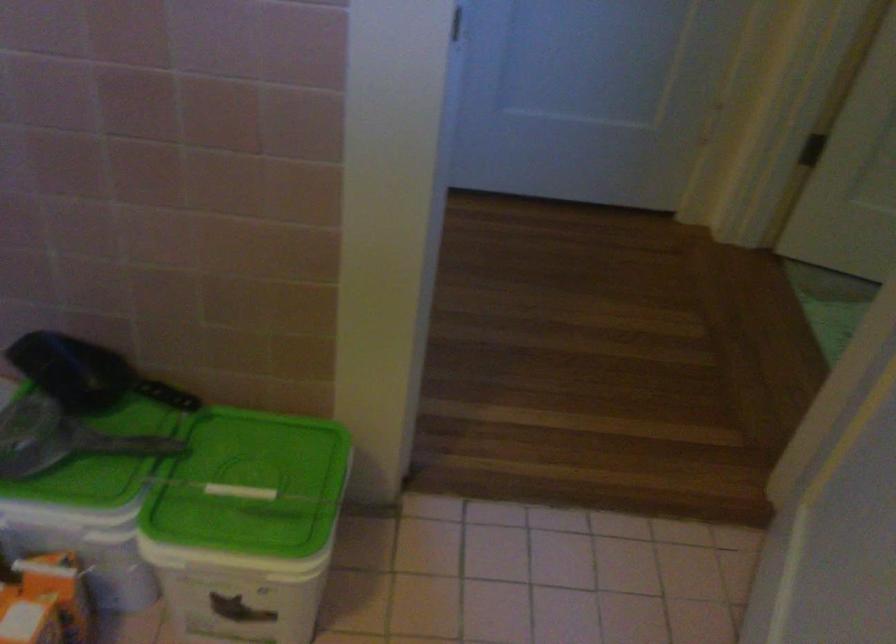
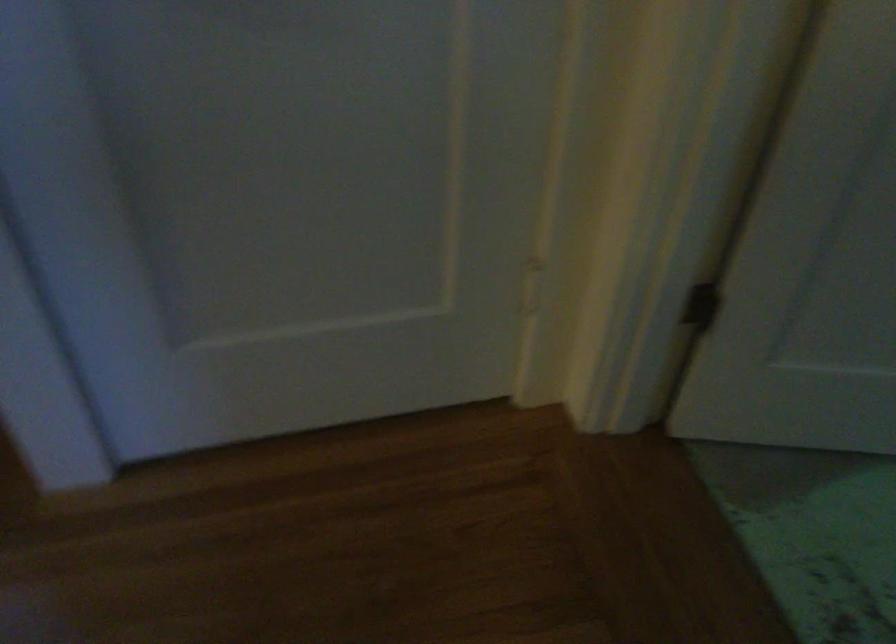
Question: Which direction would the cameraman need to move to produce the second image? Reply with the corresponding letter.

Choices:
 (A) Left
 (B) Right
 (C) Forward
 (D) Backward

Answer: (C)